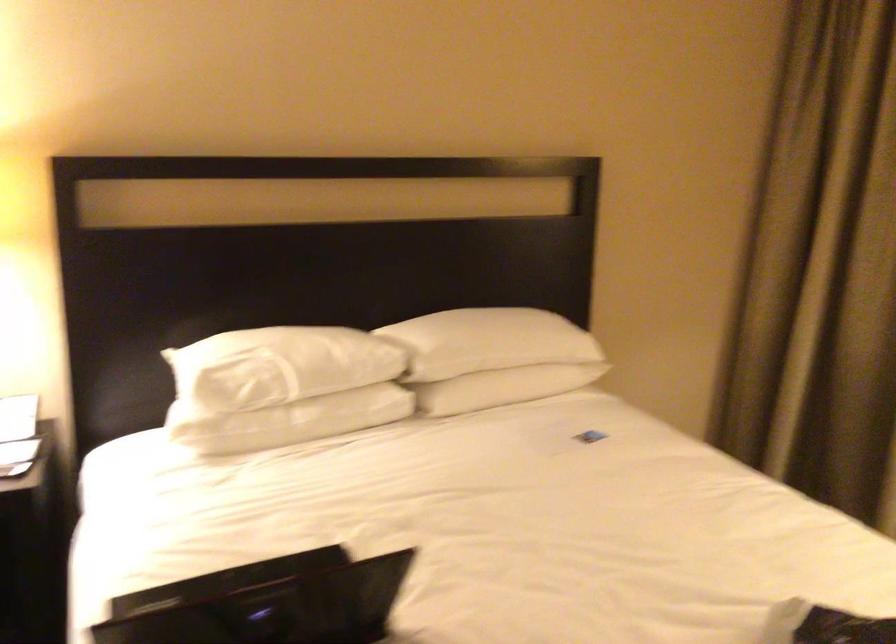
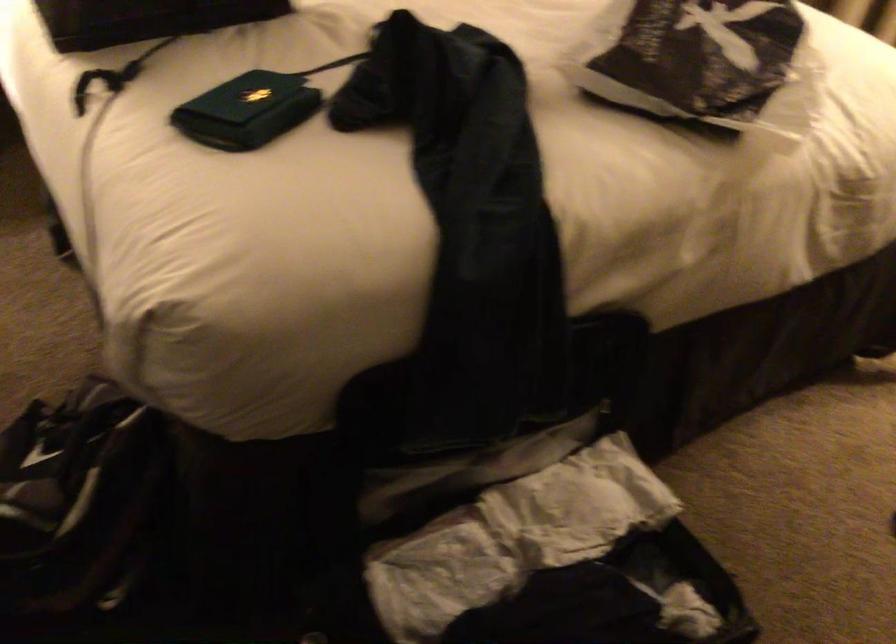
Question: The first image is from the beginning of the video and the second image is from the end. How did the camera likely rotate when shooting the video?

Choices:
 (A) Left
 (B) Right
 (C) Up
 (D) Down

Answer: (D)